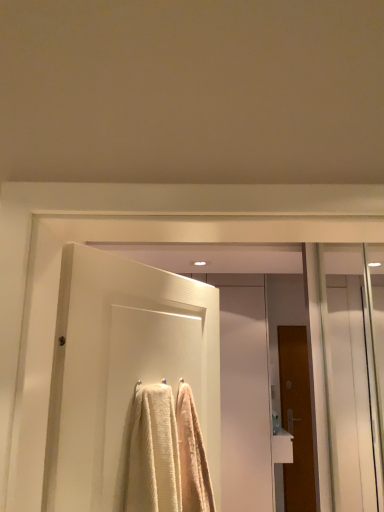
Question: Can you confirm if white glossy sink at lower right is wider than brown wooden door at right, which appears as the second door when viewed from the front?

Choices:
 (A) no
 (B) yes

Answer: (B)

Question: Does white glossy sink at lower right have a lesser width compared to brown wooden door at right, the second door positioned from the top?

Choices:
 (A) no
 (B) yes

Answer: (A)

Question: Is white glossy sink at lower right in front of brown wooden door at right, which is the 1th door from right to left?

Choices:
 (A) no
 (B) yes

Answer: (B)

Question: Is white glossy sink at lower right outside of brown wooden door at right, which is the 1th door from right to left?

Choices:
 (A) yes
 (B) no

Answer: (A)

Question: From a real-world perspective, is white glossy sink at lower right on brown wooden door at right, the second door positioned from the top?

Choices:
 (A) no
 (B) yes

Answer: (A)

Question: Could you tell me if white glossy sink at lower right is turned towards brown wooden door at right, which is the 1th door from right to left?

Choices:
 (A) yes
 (B) no

Answer: (B)

Question: Does white glossy door at center, which is the 1th screen door from back to front, have a lesser height compared to white glossy sink at lower right?

Choices:
 (A) no
 (B) yes

Answer: (A)

Question: Considering the relative positions of white glossy door at center, marked as the second screen door in a front-to-back arrangement, and white glossy sink at lower right in the image provided, is white glossy door at center, marked as the second screen door in a front-to-back arrangement, to the left of white glossy sink at lower right from the viewer's perspective?

Choices:
 (A) no
 (B) yes

Answer: (B)

Question: From a real-world perspective, is white glossy door at center, which is the 1th screen door from back to front, located higher than white glossy sink at lower right?

Choices:
 (A) yes
 (B) no

Answer: (A)

Question: Can you confirm if white glossy door at center, which is the 1th screen door from back to front, is wider than white glossy sink at lower right?

Choices:
 (A) yes
 (B) no

Answer: (B)

Question: From the image's perspective, is white glossy door at center, the second screen door in the right-to-left sequence, beneath white glossy sink at lower right?

Choices:
 (A) yes
 (B) no

Answer: (B)

Question: Are white glossy door at center, marked as the second screen door in a front-to-back arrangement, and white glossy sink at lower right located far from each other?

Choices:
 (A) yes
 (B) no

Answer: (B)

Question: Is brown wooden door at right, which is counted as the 1th door, starting from the bottom, behind white glossy door at center, marked as the second screen door in a front-to-back arrangement?

Choices:
 (A) yes
 (B) no

Answer: (A)